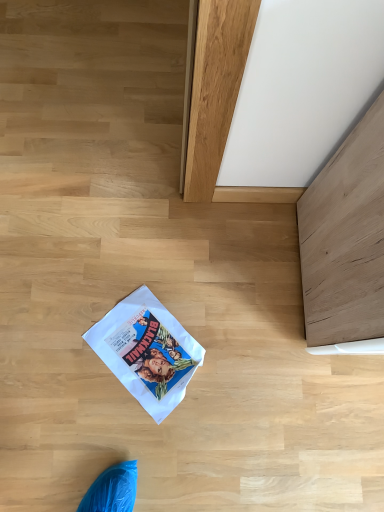
Where is `vacant space underneath white paper at center (from a real-world perspective)`? The height and width of the screenshot is (512, 384). vacant space underneath white paper at center (from a real-world perspective) is located at coordinates point(146,351).